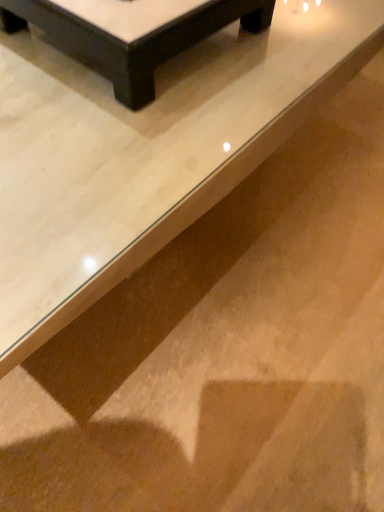
Image resolution: width=384 pixels, height=512 pixels. What are the coordinates of `free space in front of black glossy table at upper center, which is counted as the first table, starting from the back` in the screenshot? It's located at (112, 138).